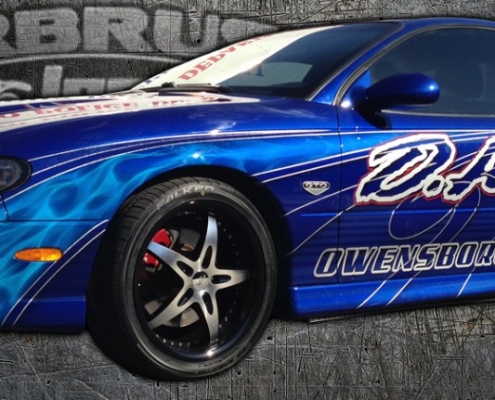
Find the location of a particular element. This screenshot has height=400, width=495. front  window is located at coordinates (258, 59).